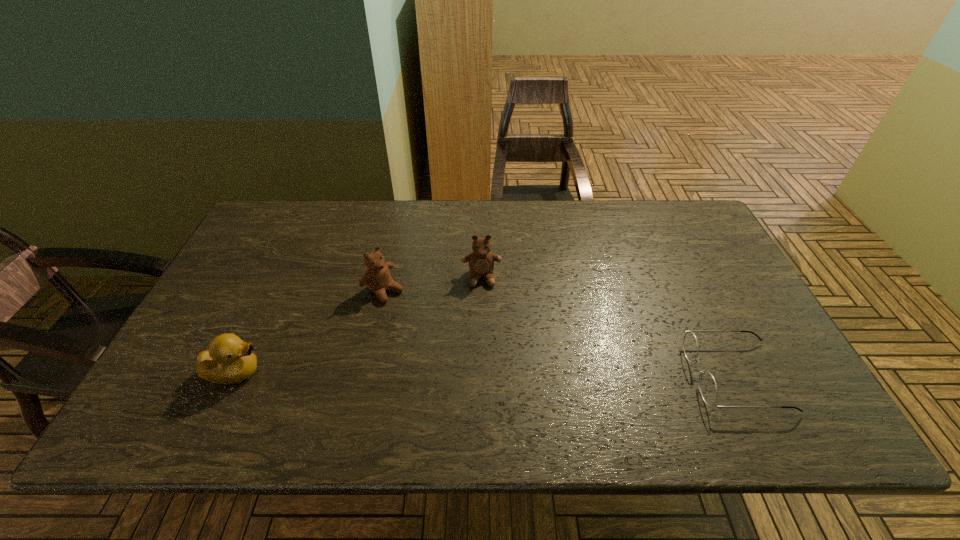
Where is `object at the near right corner`? The image size is (960, 540). object at the near right corner is located at coordinates (707, 385).

Find the location of a particular element. blank space at the far edge is located at coordinates (309, 227).

The width and height of the screenshot is (960, 540). Identify the location of free region at the near edge. (521, 387).

In the image, there is a desktop. Where is `vacant space at the left edge`? The width and height of the screenshot is (960, 540). vacant space at the left edge is located at coordinates (232, 327).

Identify the location of vacant space at the right edge. (757, 347).

Image resolution: width=960 pixels, height=540 pixels. In the image, there is a desktop. What are the coordinates of `vacant space at the far right corner` in the screenshot? It's located at (715, 242).

Image resolution: width=960 pixels, height=540 pixels. Find the location of `free space at the near right corner of the desktop`. free space at the near right corner of the desktop is located at coordinates (793, 390).

Identify the location of vacant space that is in between the shortest object and the right teddy bear. Image resolution: width=960 pixels, height=540 pixels. (609, 327).

I want to click on vacant region between the duckling and the rightmost object, so click(486, 374).

You are a GUI agent. You are given a task and a screenshot of the screen. Output one action in this format:
    pyautogui.click(x=<x>, y=<y>)
    Task: Click on the vacant area that lies between the third object from right to left and the shortest object
    The height and width of the screenshot is (540, 960).
    Given the screenshot: What is the action you would take?
    pyautogui.click(x=560, y=333)